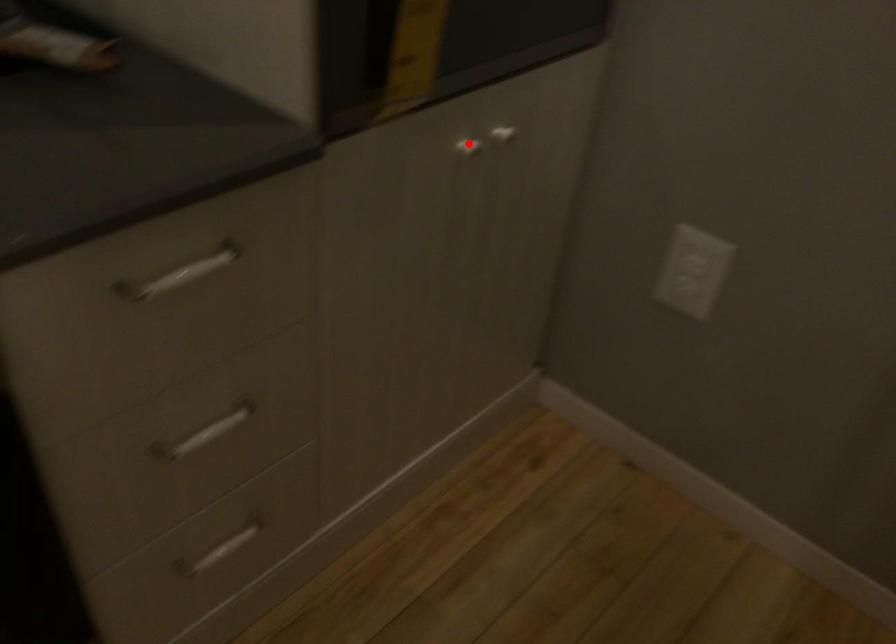
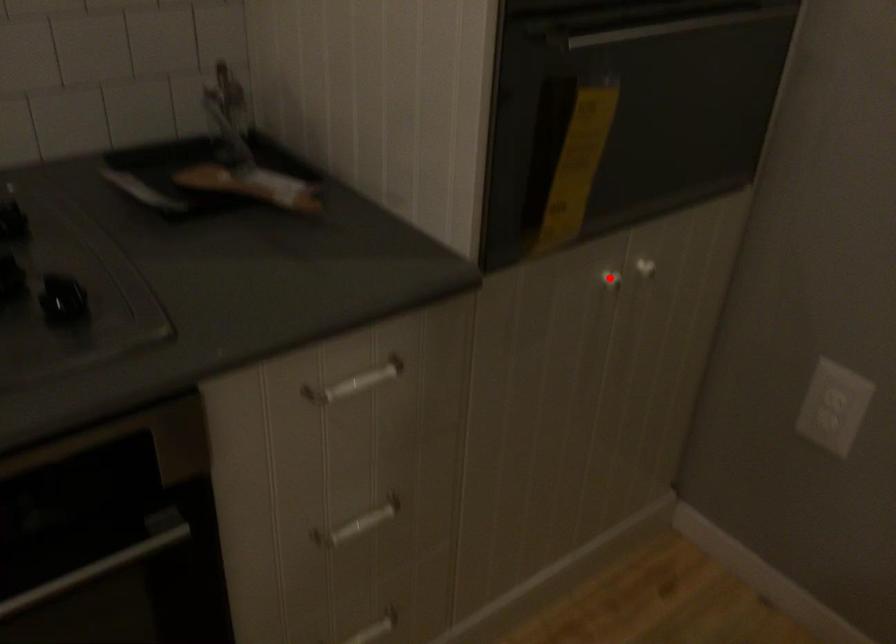
I am providing you with two images of the same scene from different viewpoints. A red point is marked on the first image and another point is marked on the second image. Is the red point in image1 aligned with the point shown in image2?

Yes